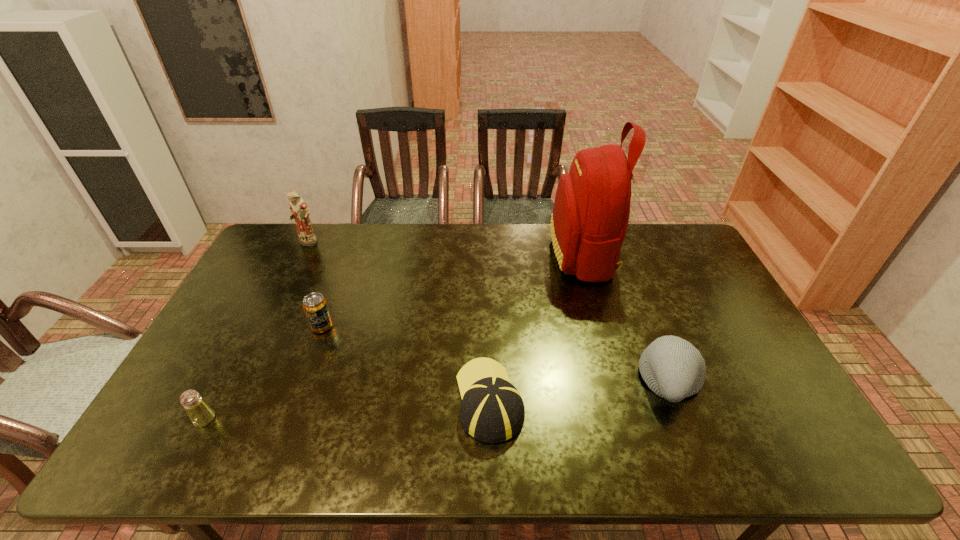
Choose which object is the fifth nearest neighbor to the soda can. Please provide its 2D coordinates. Your answer should be formatted as a tuple, i.e. [(x, y)], where the tuple contains the x and y coordinates of a point satisfying the conditions above.

[(672, 367)]

Find the location of a particular element. The image size is (960, 540). free point that satisfies the following two spatial constraints: 1. on the front-facing side of the soda can; 2. on the left side of the figurine is located at coordinates (267, 326).

Identify the location of blank space that satisfies the following two spatial constraints: 1. with the brim of the baseball cap facing forward; 2. on the right side of the beanie. (489, 380).

I want to click on vacant position in the image that satisfies the following two spatial constraints: 1. on the front-facing side of the backpack; 2. on the front side of the third farthest object, so click(603, 326).

Where is `free space that satisfies the following two spatial constraints: 1. on the front-facing side of the backpack; 2. on the front side of the third farthest object`? Image resolution: width=960 pixels, height=540 pixels. free space that satisfies the following two spatial constraints: 1. on the front-facing side of the backpack; 2. on the front side of the third farthest object is located at coordinates (603, 326).